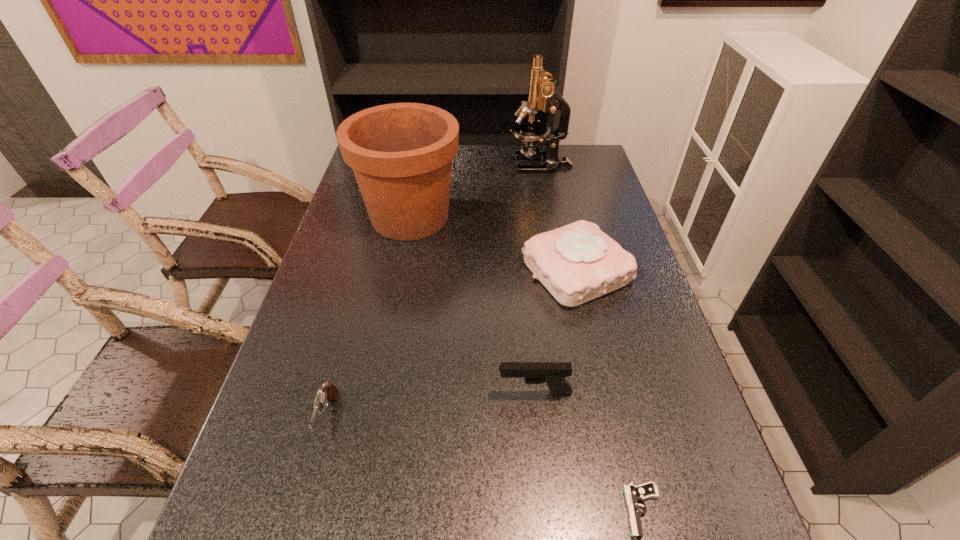
This screenshot has height=540, width=960. Find the location of `vacant region located 0.130m on the front of the fifth shortest object`. vacant region located 0.130m on the front of the fifth shortest object is located at coordinates tap(397, 282).

This screenshot has width=960, height=540. In order to click on vacant space situated 0.250m on the left of the cake in this screenshot , I will do `click(432, 271)`.

At what (x,y) coordinates should I click in order to perform the action: click on vacant space situated 0.150m on the front-facing side of the second pistol from right to left. Please return your answer as a coordinate pair (x, y). The height and width of the screenshot is (540, 960). Looking at the image, I should click on (428, 393).

Identify the location of vacant space situated on the front-facing side of the second pistol from right to left. (451, 393).

What are the coordinates of `vacant space located 0.300m on the front-facing side of the second pistol from right to left` in the screenshot? It's located at click(359, 393).

Where is `vacant region located at the barrel of the second shortest object`? This screenshot has width=960, height=540. vacant region located at the barrel of the second shortest object is located at coordinates (310, 483).

The image size is (960, 540). Find the location of `object present at the far edge`. object present at the far edge is located at coordinates (542, 94).

Where is `flowerpot positioned at the left edge`? The image size is (960, 540). flowerpot positioned at the left edge is located at coordinates (401, 154).

Image resolution: width=960 pixels, height=540 pixels. In order to click on pistol at the left edge in this screenshot , I will do `click(328, 392)`.

Where is `microscope that is positioned at the right edge`? This screenshot has height=540, width=960. microscope that is positioned at the right edge is located at coordinates (542, 94).